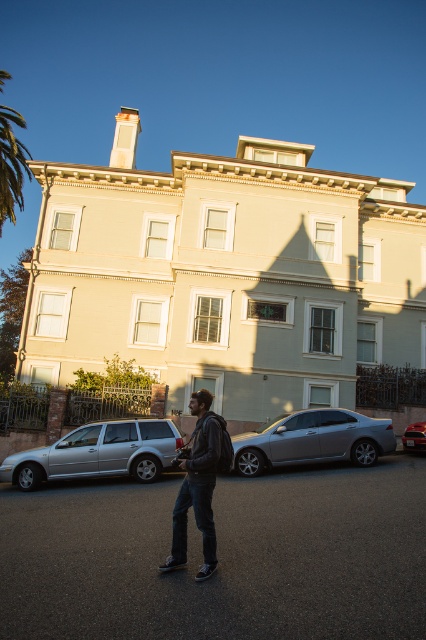
Looking at this image, who is positioned more to the left, green leafy palm tree at upper left or metallic silver sedan at center?

green leafy palm tree at upper left

Which is in front, point (2, 132) or point (414, 429)?

Point (414, 429) is in front.

Identify the location of green leafy palm tree at upper left. This screenshot has width=426, height=640. (11, 164).

Can you confirm if dark gray hoodie at center is bigger than green leafy palm tree at upper left?

Actually, dark gray hoodie at center might be smaller than green leafy palm tree at upper left.

Which of these two, dark gray hoodie at center or green leafy palm tree at upper left, stands taller?

Standing taller between the two is green leafy palm tree at upper left.

Which is behind, point (204, 426) or point (16, 112)?

The point (16, 112) is more distant.

Locate an element on the screen. dark gray hoodie at center is located at coordinates (198, 486).

In the scene shown: Is silver metallic station wagon at lower left wider than green leafy palm tree at upper left?

Incorrect, silver metallic station wagon at lower left's width does not surpass green leafy palm tree at upper left's.

Between silver metallic station wagon at lower left and green leafy palm tree at upper left, which one appears on the right side from the viewer's perspective?

Positioned to the right is silver metallic station wagon at lower left.

Is point (152, 420) in front of point (13, 179)?

Yes, point (152, 420) is closer to viewer.

The width and height of the screenshot is (426, 640). I want to click on silver metallic station wagon at lower left, so click(98, 452).